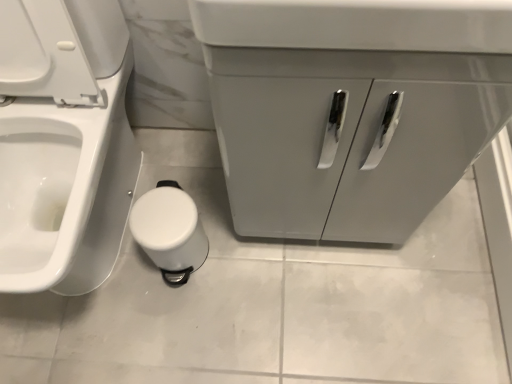
You are a GUI agent. You are given a task and a screenshot of the screen. Output one action in this format:
    pyautogui.click(x=<x>, y=<y>)
    Task: Click on the vacant area that lies between matte gray cabinet at center and white plastic toilet paper at lower center
    
    Given the screenshot: What is the action you would take?
    pyautogui.click(x=232, y=237)